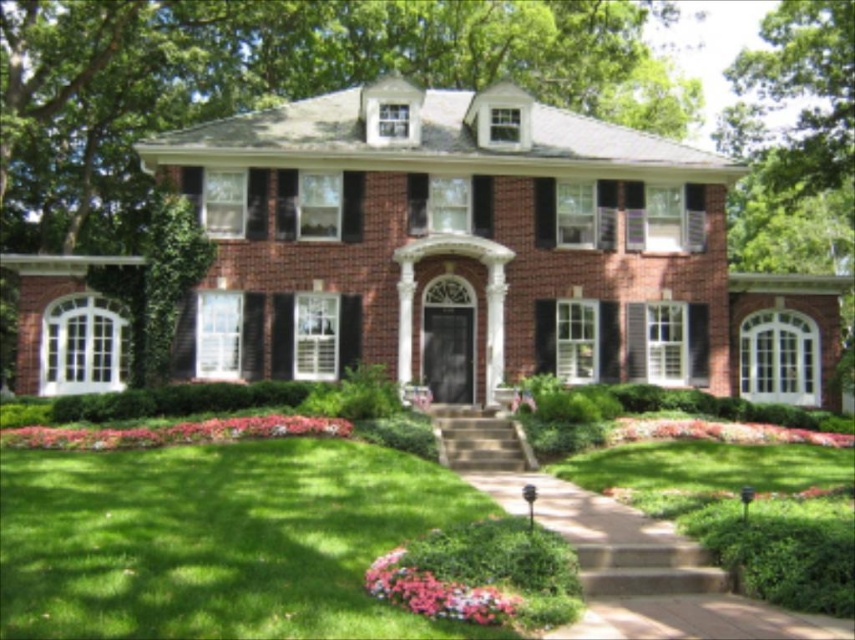
Question: Which is nearer to the pink matte flowers at lower left?

Choices:
 (A) pastel floral carpet at lower center
 (B) pink floral bed at lower right
 (C) green leafy tree at upper center

Answer: (B)

Question: In this image, where is pastel floral carpet at lower center located relative to pink floral bed at lower right?

Choices:
 (A) right
 (B) left

Answer: (B)

Question: Is green leafy tree at upper center positioned at the back of pink floral bed at lower right?

Choices:
 (A) no
 (B) yes

Answer: (B)

Question: Is green leafy tree at upper center bigger than pastel floral carpet at lower center?

Choices:
 (A) no
 (B) yes

Answer: (B)

Question: Which object is farther from the camera taking this photo?

Choices:
 (A) pink matte flowers at lower left
 (B) pastel floral carpet at lower center
 (C) green leafy tree at upper center

Answer: (C)

Question: Which point is farther to the camera?

Choices:
 (A) (19, 138)
 (B) (823, 435)
 (C) (485, 609)

Answer: (A)